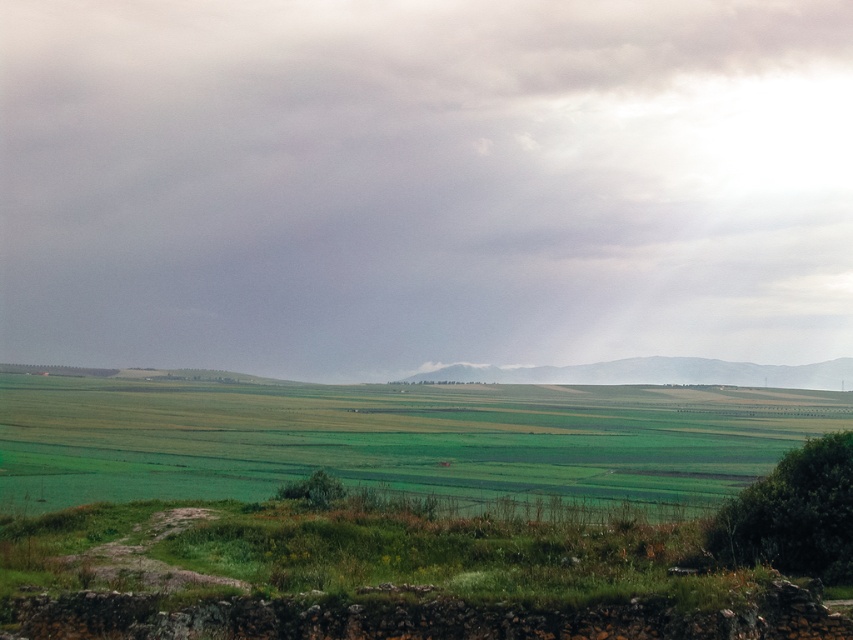
Question: Which point appears farthest from the camera in this image?

Choices:
 (A) (775, 433)
 (B) (813, 364)
 (C) (199, 296)

Answer: (B)

Question: Which point appears farthest from the camera in this image?

Choices:
 (A) (674, 381)
 (B) (744, 40)
 (C) (775, 436)

Answer: (B)

Question: Can you confirm if cloudy sky at upper center is positioned below green grassy hillside at center?

Choices:
 (A) no
 (B) yes

Answer: (A)

Question: From the image, what is the correct spatial relationship of cloudy sky at upper center in relation to green grassy field at lower center?

Choices:
 (A) below
 (B) above

Answer: (B)

Question: Can you confirm if cloudy sky at upper center is bigger than green grassy field at lower center?

Choices:
 (A) no
 (B) yes

Answer: (B)

Question: Among these objects, which one is nearest to the camera?

Choices:
 (A) green grassy field at lower center
 (B) green grassy hillside at center

Answer: (A)